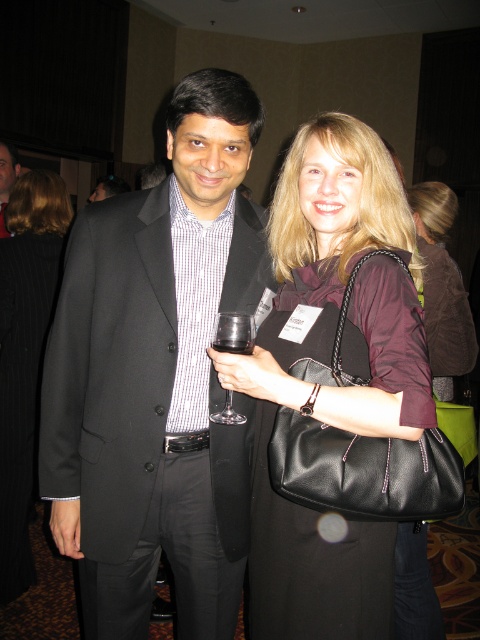
Question: Does maroon leather jacket at center appear on the left side of transparent glass at center?

Choices:
 (A) yes
 (B) no

Answer: (B)

Question: Which object appears closest to the camera in this image?

Choices:
 (A) matte black suit at center
 (B) maroon leather jacket at center
 (C) black wool coat at upper left

Answer: (B)

Question: Does black matte suit at center have a greater width compared to black wool coat at upper left?

Choices:
 (A) no
 (B) yes

Answer: (B)

Question: Is black matte suit at center below transparent glass at center?

Choices:
 (A) no
 (B) yes

Answer: (B)

Question: Which object appears farthest from the camera in this image?

Choices:
 (A) leather handbag at center
 (B) clear glass wine at center
 (C) black matte suit at center
 (D) maroon leather jacket at center

Answer: (A)

Question: Which object appears closest to the camera in this image?

Choices:
 (A) transparent glass at center
 (B) matte black suit at center

Answer: (A)